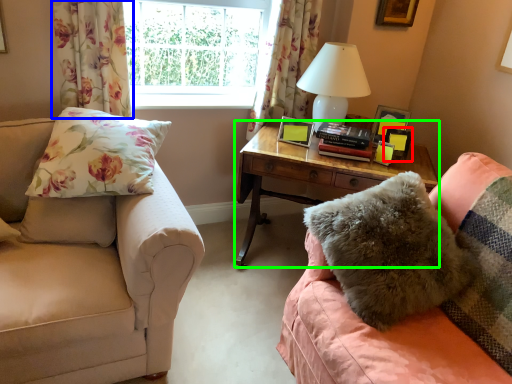
Question: Based on their relative distances, which object is farther from picture frame (highlighted by a red box)? Choose from curtain (highlighted by a blue box) and nightstand (highlighted by a green box).

Choices:
 (A) curtain
 (B) nightstand

Answer: (A)